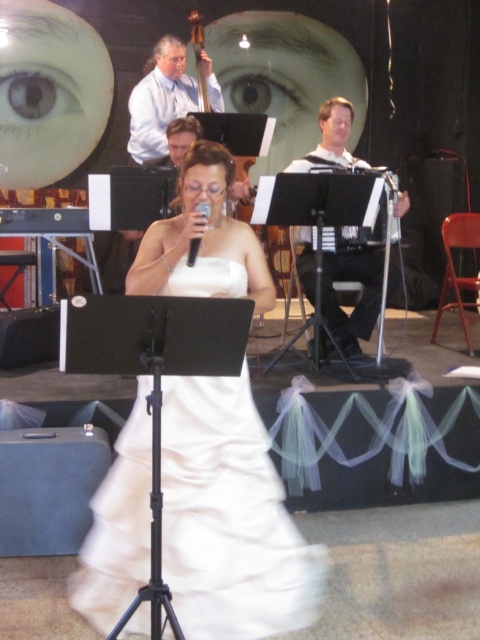
In the scene shown: Does white satin dress at center appear on the left side of brown matte eye at upper left?

In fact, white satin dress at center is to the right of brown matte eye at upper left.

Can you confirm if white satin dress at center is positioned to the right of brown matte eye at upper left?

Yes, white satin dress at center is to the right of brown matte eye at upper left.

Is point (252, 244) in front of point (45, 88)?

Yes, point (252, 244) is in front of point (45, 88).

The image size is (480, 640). What are the coordinates of `white satin dress at center` in the screenshot? It's located at (229, 518).

Which is behind, point (345, 161) or point (156, 74)?

Point (156, 74)

Which is in front, point (375, 268) or point (171, 118)?

Point (375, 268) is more forward.

Is point (310, 296) farther from viewer compared to point (146, 72)?

No, it is not.

Identify the location of white fabric dress at center. (360, 298).

Can you confirm if white fabric dress at center is positioned to the right of brown matte eye at upper left?

Yes, white fabric dress at center is to the right of brown matte eye at upper left.

Between white fabric dress at center and brown matte eye at upper left, which one appears on the right side from the viewer's perspective?

From the viewer's perspective, white fabric dress at center appears more on the right side.

Is point (393, 275) behind point (25, 93)?

That is False.

Locate an element on the screen. white fabric dress at center is located at coordinates (360, 298).